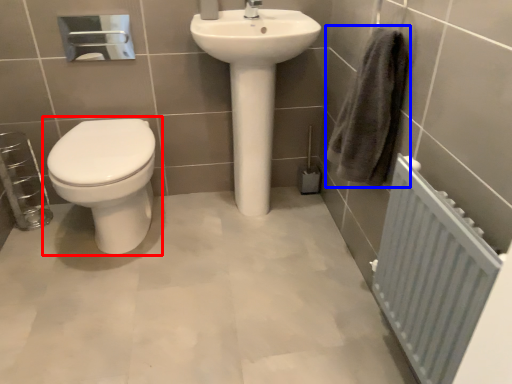
Question: Which of the following is the closest to the observer, toilet (highlighted by a red box) or bath towel (highlighted by a blue box)?

Choices:
 (A) toilet
 (B) bath towel

Answer: (B)